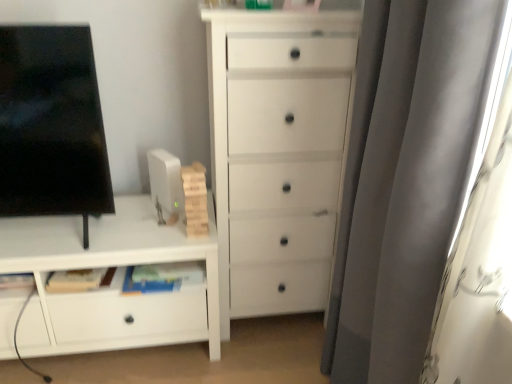
The width and height of the screenshot is (512, 384). Identify the location of free spot above white matte cabinet at lower left, which ranks as the 1th chest of drawers in left-to-right order (from a real-world perspective). (93, 226).